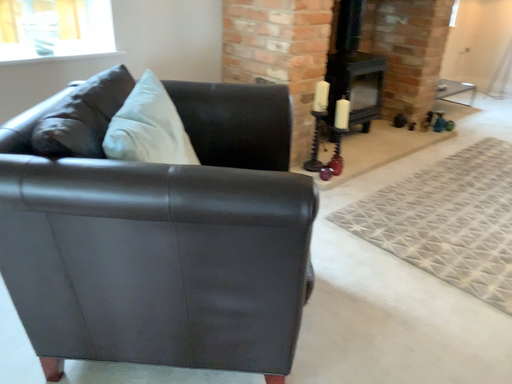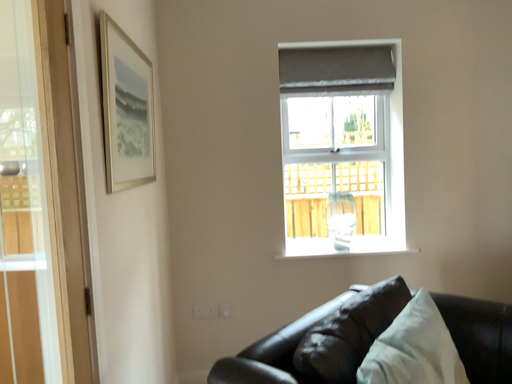
Question: Which way did the camera rotate in the video?

Choices:
 (A) rotated downward
 (B) rotated upward

Answer: (B)